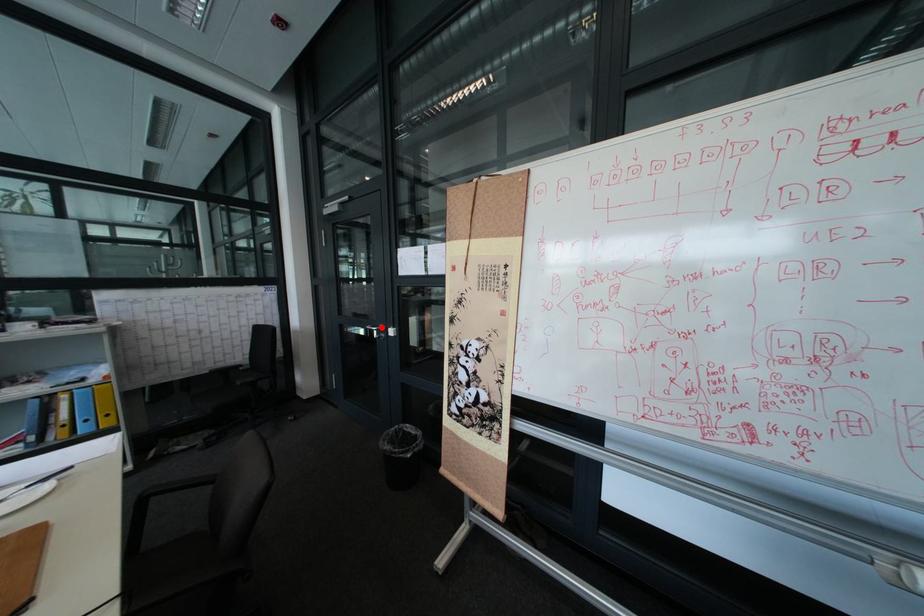
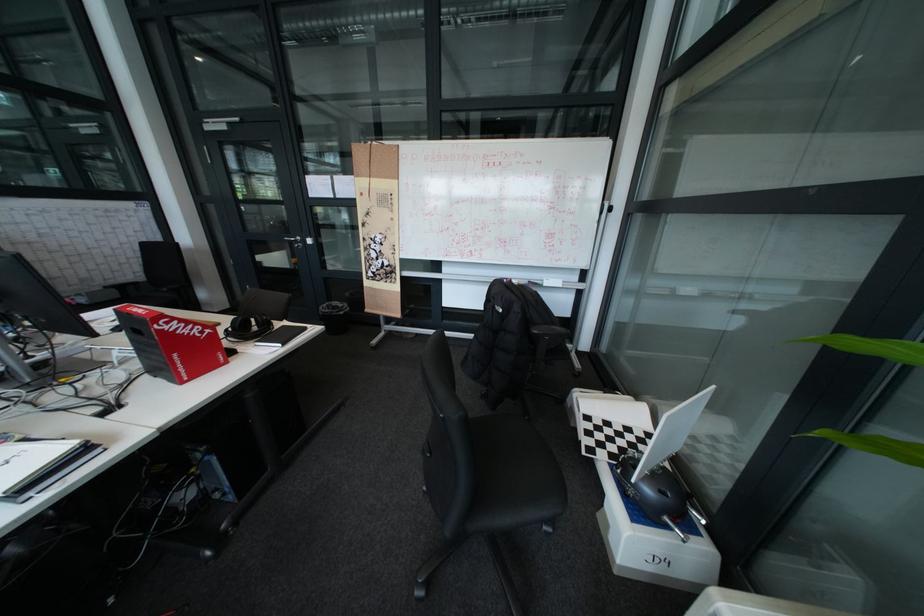
Question: I am providing you with two images of the same scene from different viewpoints. A red point is shown in image1. For the corresponding object point in image2, is it positioned nearer or farther from the camera?

Choices:
 (A) Nearer
 (B) Farther

Answer: (A)